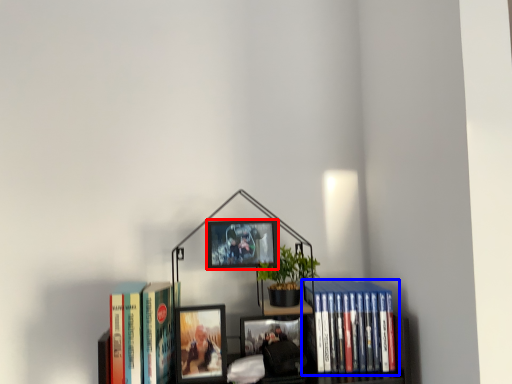
Question: Which object is closer to the camera taking this photo, picture frame (highlighted by a red box) or book (highlighted by a blue box)?

Choices:
 (A) picture frame
 (B) book

Answer: (A)